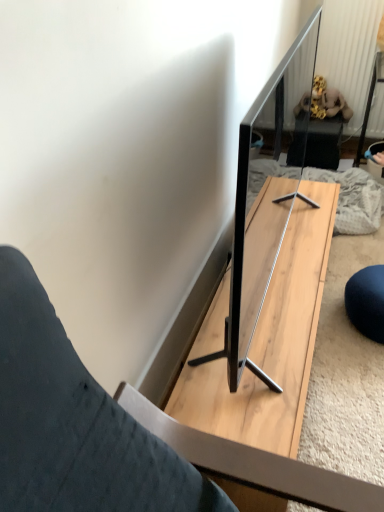
The height and width of the screenshot is (512, 384). Find the location of `free space above velvet plush toy at upper right (from a real-world perspective)`. free space above velvet plush toy at upper right (from a real-world perspective) is located at coordinates (326, 117).